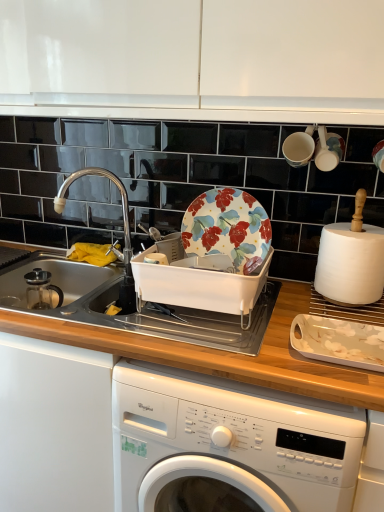
Find the location of a particular element. Image resolution: width=384 pixels, height=512 pixels. vacant area on top of white glossy washing machine at lower center (from a real-world perspective) is located at coordinates (287, 326).